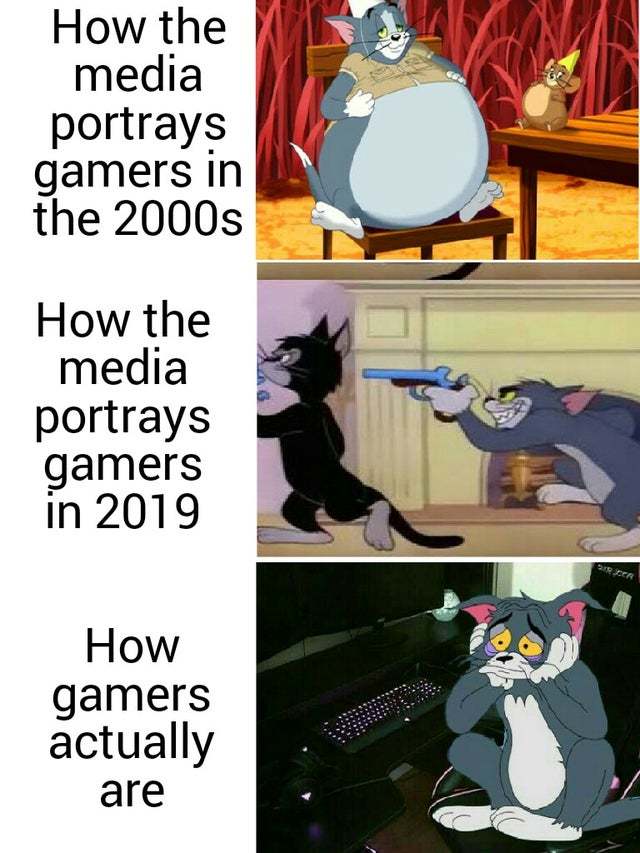
Where is `frames`? This screenshot has height=853, width=640. frames is located at coordinates (568, 134), (509, 432), (422, 729).